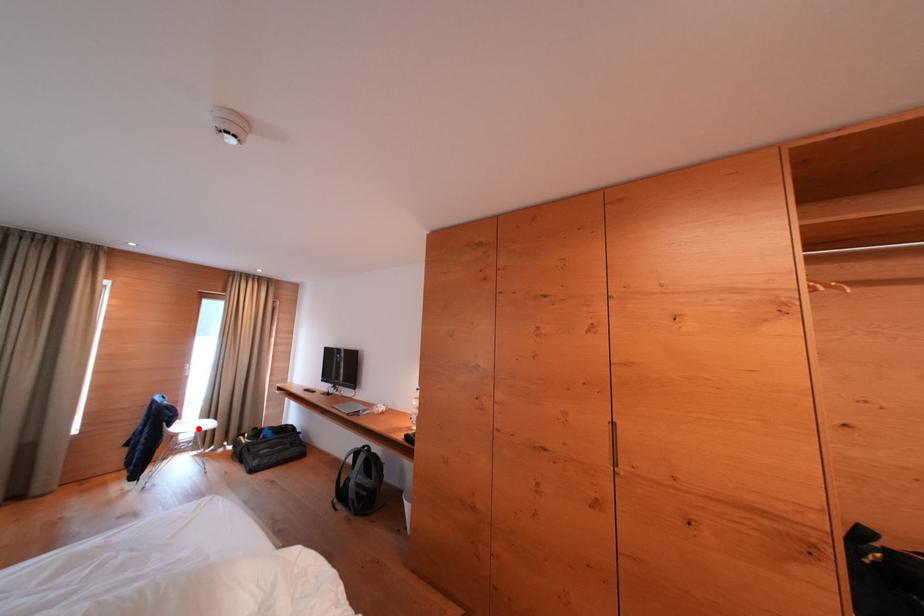
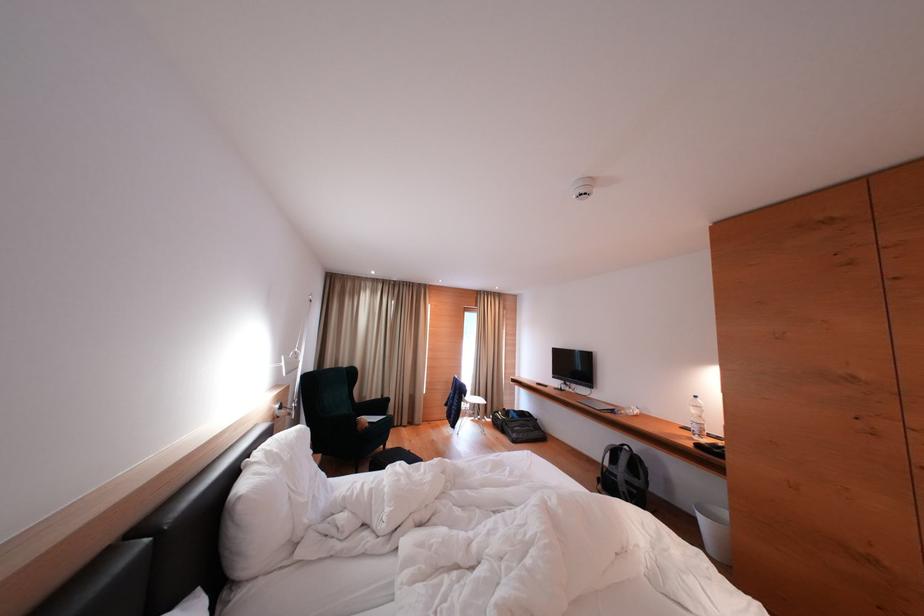
Question: I am providing you with two images of the same scene from different viewpoints. Image1 has a red point marked. In image2, the corresponding 3D location appears at what relative position? Reply with the corresponding letter.

Choices:
 (A) Closer
 (B) Farther

Answer: (B)